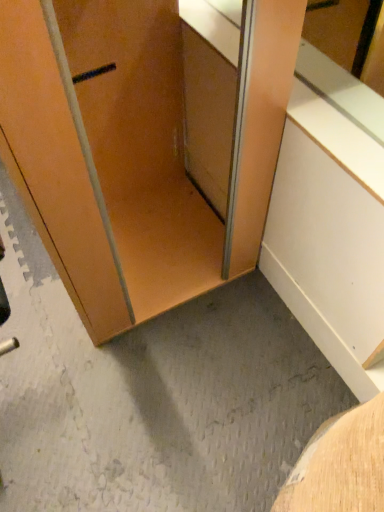
The height and width of the screenshot is (512, 384). I want to click on matte wood cabinet at center, so (136, 149).

Describe the element at coordinates (136, 149) in the screenshot. I see `matte wood cabinet at center` at that location.

Where is `matte wood cabinet at center`? matte wood cabinet at center is located at coordinates (136, 149).